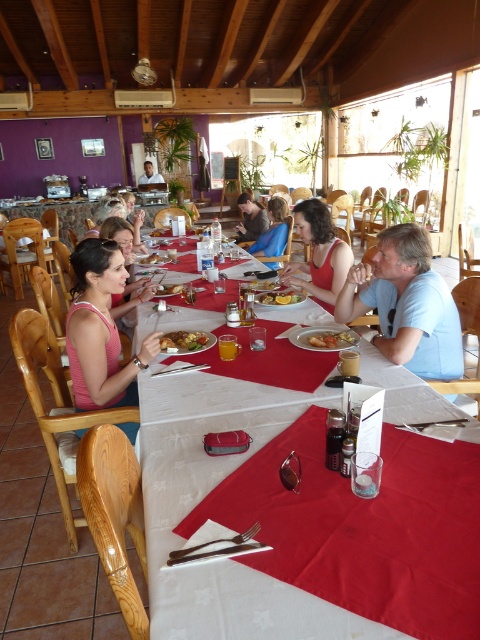
Question: Does pink fabric at left appear under blue fabric shirt at center?

Choices:
 (A) no
 (B) yes

Answer: (B)

Question: Can you confirm if matte red tank top at center is positioned below golden fried chicken at center?

Choices:
 (A) no
 (B) yes

Answer: (A)

Question: Is white fabric table at center to the right of golden crispy chicken at center from the viewer's perspective?

Choices:
 (A) yes
 (B) no

Answer: (B)

Question: Which object is positioned farthest from the green leafy vegetables at center?

Choices:
 (A) matte black shirt at center
 (B) matte brown bread at center
 (C) golden crispy chicken at center

Answer: (A)

Question: Which point is closer to the camera taking this photo?

Choices:
 (A) (271, 285)
 (B) (444, 353)
 (C) (260, 234)

Answer: (B)

Question: Considering the real-world distances, which object is closest to the golden fried chicken at center?

Choices:
 (A) blue fabric shirt at center
 (B) matte black shirt at center
 (C) matte brown bread at center
 (D) green leafy vegetables at center

Answer: (C)